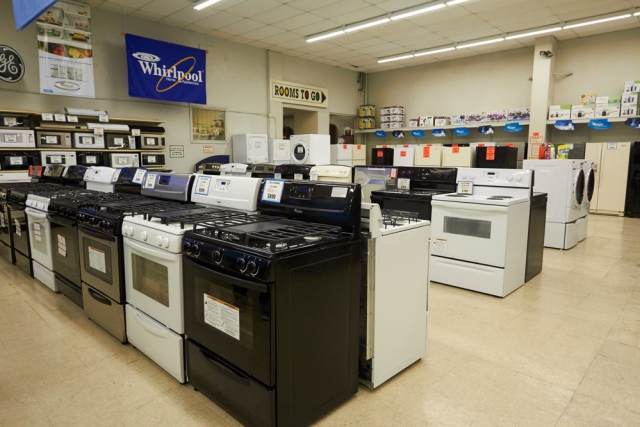
In order to click on dryer in this screenshot , I will do `click(589, 183)`.